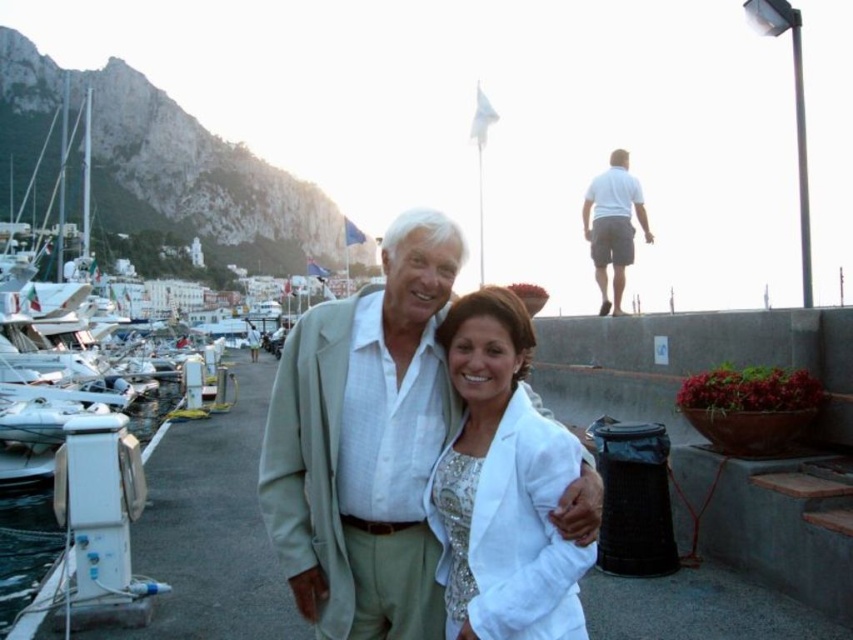
Question: Considering the real-world distances, which object is closest to the light green fabric suit at center?

Choices:
 (A) white cotton shirt at upper right
 (B) white satin blazer at center

Answer: (B)

Question: Is white satin blazer at center above white cotton shirt at upper right?

Choices:
 (A) no
 (B) yes

Answer: (A)

Question: Observing the image, what is the correct spatial positioning of light green fabric suit at center in reference to white satin blazer at center?

Choices:
 (A) below
 (B) above

Answer: (B)

Question: Which point is farther from the camera taking this photo?

Choices:
 (A) (457, 352)
 (B) (616, 212)

Answer: (B)

Question: Can you confirm if white satin blazer at center is positioned below white cotton shirt at upper right?

Choices:
 (A) yes
 (B) no

Answer: (A)

Question: Which of the following is the closest to the observer?

Choices:
 (A) (486, 417)
 (B) (614, 196)

Answer: (A)